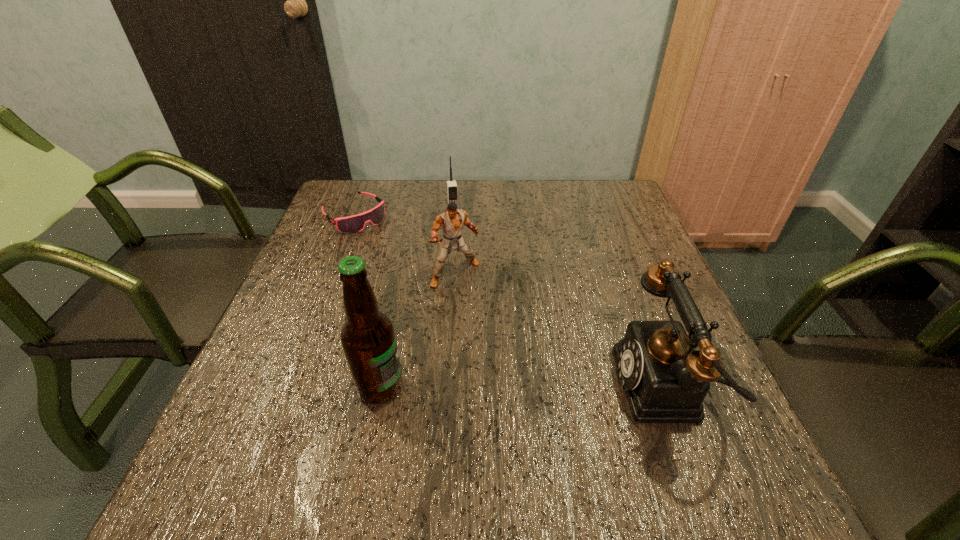
At what (x,y) coordinates should I click in order to perform the action: click on vacant space on the desktop that is between the tallest object and the telephone and is positioned on the front-facing side of the third nearest object. Please return your answer as a coordinate pair (x, y). Looking at the image, I should click on (540, 387).

At what (x,y) coordinates should I click in order to perform the action: click on vacant space on the desktop that is between the tallest object and the rightmost object and is positioned on the front-facing side of the goggles. Please return your answer as a coordinate pair (x, y). Looking at the image, I should click on (541, 387).

Locate an element on the screen. The image size is (960, 540). vacant spot on the desktop that is between the fourth object from right to left and the telephone and is positioned on the front-facing side of the cellular telephone is located at coordinates (491, 387).